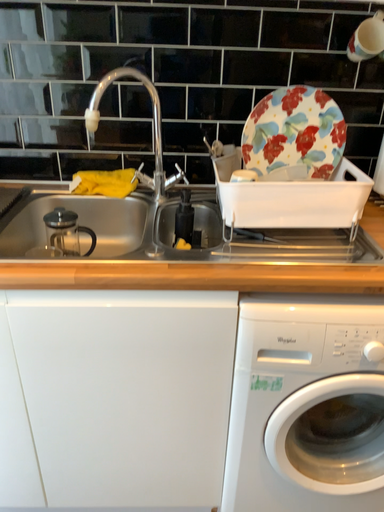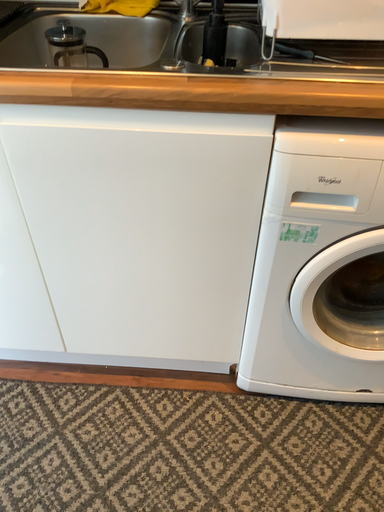
Question: Which way did the camera rotate in the video?

Choices:
 (A) rotated downward
 (B) rotated upward

Answer: (A)